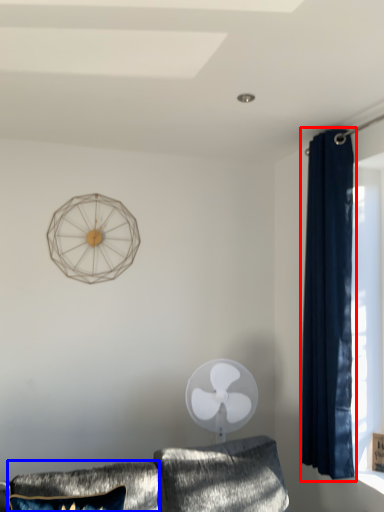
Question: Which point is closer to the camera, curtain (highlighted by a red box) or pillow (highlighted by a blue box)?

Choices:
 (A) curtain
 (B) pillow

Answer: (B)